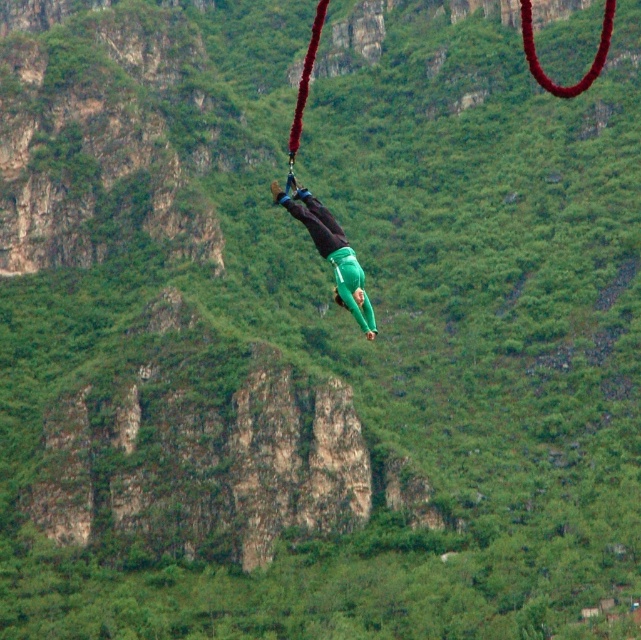
Question: Does green fabric person at center have a smaller size compared to red fabric rope at center?

Choices:
 (A) yes
 (B) no

Answer: (B)

Question: Among these objects, which one is nearest to the camera?

Choices:
 (A) green fabric person at center
 (B) red fabric rope at center

Answer: (A)

Question: Observing the image, what is the correct spatial positioning of green fabric person at center in reference to red fabric rope at center?

Choices:
 (A) above
 (B) below

Answer: (B)

Question: Which point is farther to the camera?

Choices:
 (A) green fabric person at center
 (B) red fabric rope at center

Answer: (B)

Question: Can you confirm if green fabric person at center is wider than red fabric rope at center?

Choices:
 (A) no
 (B) yes

Answer: (A)